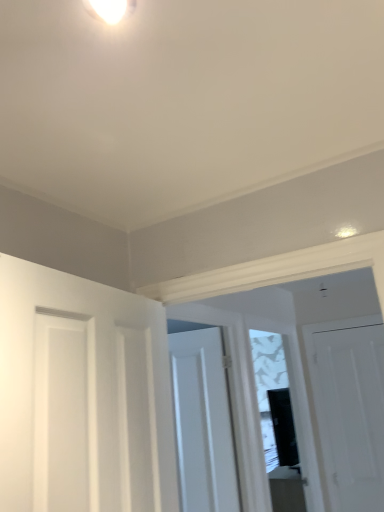
Locate an element on the screen. The image size is (384, 512). white glossy light fixture at upper center is located at coordinates (110, 9).

Based on the photo, measure the distance between point (x=358, y=356) and camera.

9.78 feet.

The image size is (384, 512). What do you see at coordinates (351, 413) in the screenshot?
I see `white matte door at right, arranged as the first door when viewed from the back` at bounding box center [351, 413].

What is the approximate height of white matte door at center, which is counted as the second door, starting from the right?

The height of white matte door at center, which is counted as the second door, starting from the right, is 36.90 inches.

At what (x,y) coordinates should I click in order to perform the action: click on transparent glass window at center. Please return your answer as a coordinate pair (x, y). Looking at the image, I should click on (275, 390).

You are a GUI agent. You are given a task and a screenshot of the screen. Output one action in this format:
    pyautogui.click(x=<x>, y=<y>)
    Task: Click on the white matte door at left, arranged as the 3th door when viewed from the right
    This screenshot has height=512, width=384.
    Given the screenshot: What is the action you would take?
    pyautogui.click(x=82, y=396)

Identify the location of white glossy light fixture at upper center. The width and height of the screenshot is (384, 512). (110, 9).

Is white glossy light fixture at upper center to the left or to the right of white matte door at right, the 3th door from the left, in the image?

From the image, it's evident that white glossy light fixture at upper center is to the left of white matte door at right, the 3th door from the left.

Considering the sizes of objects white glossy light fixture at upper center and white matte door at right, the third door in the front-to-back sequence, in the image provided, who is wider, white glossy light fixture at upper center or white matte door at right, the third door in the front-to-back sequence,?

white glossy light fixture at upper center is wider.

From the image's perspective, between white glossy light fixture at upper center and white matte door at right, arranged as the first door when viewed from the back, who is located below?

white matte door at right, arranged as the first door when viewed from the back, appears lower in the image.

Is white matte door at right, placed as the first door when sorted from right to left, completely or partially inside white glossy light fixture at upper center?

No, white glossy light fixture at upper center does not contain white matte door at right, placed as the first door when sorted from right to left.

Is white glossy light fixture at upper center in front of white matte door at center, the 2th door viewed from the left?

Yes, white glossy light fixture at upper center is closer to the camera.

Based on their sizes in the image, would you say white glossy light fixture at upper center is bigger or smaller than white matte door at center, which is counted as the second door, starting from the right?

white glossy light fixture at upper center is smaller than white matte door at center, which is counted as the second door, starting from the right.

Does white glossy light fixture at upper center have a lesser height compared to white matte door at center, the 2th door viewed from the left?

Yes, white glossy light fixture at upper center is shorter than white matte door at center, the 2th door viewed from the left.

Is point (108, 2) less distant than point (207, 416)?

Yes, it is in front of point (207, 416).

Does white matte door at center, the 2th door positioned from the back, have a larger size compared to white matte door at right, the 3th door from the left?

No.

From a real-world perspective, is white matte door at center, the 2th door viewed from the left, on white matte door at right, the 3th door from the left?

Yes, from a real-world perspective, white matte door at center, the 2th door viewed from the left, is above white matte door at right, the 3th door from the left.

Which object is positioned more to the right, white matte door at center, the 2th door positioned from the back, or white matte door at right, the third door in the front-to-back sequence?

Positioned to the right is white matte door at right, the third door in the front-to-back sequence.

Is white matte door at left, the 1th door when ordered from left to right, next to white matte door at right, the third door in the front-to-back sequence?

white matte door at left, the 1th door when ordered from left to right, is not next to white matte door at right, the third door in the front-to-back sequence, and they're not touching.

The width and height of the screenshot is (384, 512). In order to click on the 2nd door below the white matte door at left, the 1th door when ordered from left to right (from the image's perspective) in this screenshot , I will do `click(351, 413)`.

From a real-world perspective, is white matte door at left, the 1th door when ordered from left to right, located higher than white matte door at right, the 3th door from the left?

Yes, from a real-world perspective, white matte door at left, the 1th door when ordered from left to right, is over white matte door at right, the 3th door from the left

Is white matte door at left, arranged as the third door when viewed from the back, facing away from white matte door at right, placed as the first door when sorted from right to left?

No, white matte door at left, arranged as the third door when viewed from the back, is not facing away from white matte door at right, placed as the first door when sorted from right to left.

From the transparent glass window at center, count the 1st door to the left and point to it. Please provide its 2D coordinates.

[(203, 422)]

Between white matte door at center, the 2th door positioned from the back, and transparent glass window at center, which one has more height?

transparent glass window at center is taller.

Is transparent glass window at center completely or partially inside white matte door at center, which is counted as the second door, starting from the right?

No, transparent glass window at center is not a part of white matte door at center, which is counted as the second door, starting from the right.

Based on the photo, is white matte door at right, arranged as the first door when viewed from the back, beside transparent glass window at center?

white matte door at right, arranged as the first door when viewed from the back, and transparent glass window at center are not in contact.

Considering the positions of objects white matte door at right, arranged as the first door when viewed from the back, and transparent glass window at center in the image provided, who is more to the right, white matte door at right, arranged as the first door when viewed from the back, or transparent glass window at center?

white matte door at right, arranged as the first door when viewed from the back, is more to the right.

From a real-world perspective, is white matte door at right, placed as the first door when sorted from right to left, positioned over transparent glass window at center based on gravity?

No, from a real-world perspective, white matte door at right, placed as the first door when sorted from right to left, is not over transparent glass window at center

From the picture: Is white matte door at right, arranged as the first door when viewed from the back, aimed at transparent glass window at center?

No, white matte door at right, arranged as the first door when viewed from the back, is not aimed at transparent glass window at center.

Which object is more forward, transparent glass window at center or white matte door at left, the 1th door when ordered from left to right?

white matte door at left, the 1th door when ordered from left to right, is closer to the camera.

Which object is positioned more to the left, transparent glass window at center or white matte door at left, acting as the first door starting from the front?

Positioned to the left is white matte door at left, acting as the first door starting from the front.

Considering the relative sizes of transparent glass window at center and white matte door at left, the 1th door when ordered from left to right, in the image provided, is transparent glass window at center shorter than white matte door at left, the 1th door when ordered from left to right,?

No, transparent glass window at center is not shorter than white matte door at left, the 1th door when ordered from left to right.

Is transparent glass window at center not near white matte door at left, acting as the first door starting from the front?

That's right, there is a large distance between transparent glass window at center and white matte door at left, acting as the first door starting from the front.

In order to click on the 3rd door below the white glossy light fixture at upper center (from the image's perspective) in this screenshot , I will do [x=351, y=413].

Locate an element on the screen. light fixture on the left of the white matte door at center, arranged as the 2th door when viewed from the front is located at coordinates (110, 9).

Which object lies nearer to the anchor point white matte door at right, the 3th door from the left, white glossy light fixture at upper center or transparent glass window at center?

transparent glass window at center is closer to white matte door at right, the 3th door from the left.

Based on their spatial positions, is transparent glass window at center or white matte door at left, arranged as the third door when viewed from the back, closer to white matte door at center, the 2th door positioned from the back?

white matte door at left, arranged as the third door when viewed from the back, is positioned closer to the anchor white matte door at center, the 2th door positioned from the back.

Which object lies nearer to the anchor point transparent glass window at center, white matte door at left, arranged as the third door when viewed from the back, or white matte door at right, placed as the first door when sorted from right to left?

white matte door at right, placed as the first door when sorted from right to left.

From the image, which object appears to be nearer to white matte door at right, placed as the first door when sorted from right to left, white matte door at left, arranged as the 3th door when viewed from the right, or transparent glass window at center?

Based on the image, transparent glass window at center appears to be nearer to white matte door at right, placed as the first door when sorted from right to left.

Considering their positions, is white matte door at left, arranged as the third door when viewed from the back, positioned closer to transparent glass window at center than white matte door at center, the 2th door viewed from the left?

white matte door at center, the 2th door viewed from the left, lies closer to transparent glass window at center than the other object.

Estimate the real-world distances between objects in this image. Which object is closer to white matte door at center, the 2th door positioned from the back, white glossy light fixture at upper center or white matte door at left, arranged as the third door when viewed from the back?

white matte door at left, arranged as the third door when viewed from the back, is closer to white matte door at center, the 2th door positioned from the back.

From the image, which object appears to be nearer to white matte door at left, arranged as the 3th door when viewed from the right, white matte door at center, which is counted as the second door, starting from the right, or white glossy light fixture at upper center?

white glossy light fixture at upper center is closer to white matte door at left, arranged as the 3th door when viewed from the right.

Looking at the image, which one is located closer to white matte door at right, the third door in the front-to-back sequence, transparent glass window at center or white glossy light fixture at upper center?

Based on the image, transparent glass window at center appears to be nearer to white matte door at right, the third door in the front-to-back sequence.

In order to click on light fixture between white matte door at left, the 1th door when ordered from left to right, and white matte door at right, the 3th door from the left, from front to back in this screenshot , I will do `click(110, 9)`.

At what (x,y) coordinates should I click in order to perform the action: click on light fixture located between white matte door at left, the 1th door when ordered from left to right, and transparent glass window at center in the depth direction. Please return your answer as a coordinate pair (x, y). Looking at the image, I should click on (110, 9).

Locate an element on the screen. light fixture between white matte door at left, the 1th door when ordered from left to right, and white matte door at center, the 2th door viewed from the left, along the z-axis is located at coordinates (110, 9).

Identify the location of window situated between white matte door at center, the 2th door positioned from the back, and white matte door at right, placed as the first door when sorted from right to left, from left to right. The width and height of the screenshot is (384, 512). (275, 390).